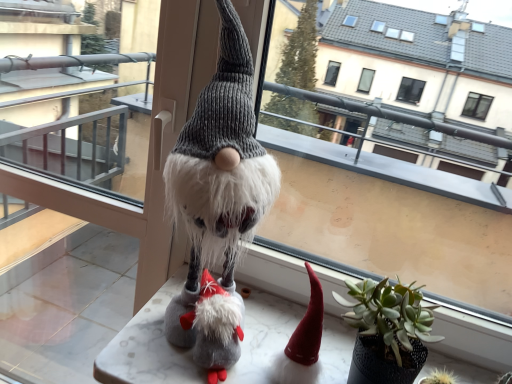
Question: Is transparent glass door at center far from green matte houseplant at center?

Choices:
 (A) yes
 (B) no

Answer: (A)

Question: Is transparent glass door at center behind green matte houseplant at center?

Choices:
 (A) no
 (B) yes

Answer: (B)

Question: Is transparent glass door at center surrounding green matte houseplant at center?

Choices:
 (A) yes
 (B) no

Answer: (B)

Question: Considering the relative sizes of transparent glass door at center and green matte houseplant at center in the image provided, is transparent glass door at center taller than green matte houseplant at center?

Choices:
 (A) yes
 (B) no

Answer: (A)

Question: Does transparent glass door at center touch green matte houseplant at center?

Choices:
 (A) yes
 (B) no

Answer: (B)

Question: From the image's perspective, is transparent glass door at center located beneath green matte houseplant at center?

Choices:
 (A) yes
 (B) no

Answer: (B)

Question: Does fuzzy gray knit gnome at center have a larger size compared to marble table at center?

Choices:
 (A) yes
 (B) no

Answer: (A)

Question: Is fuzzy gray knit gnome at center directly adjacent to marble table at center?

Choices:
 (A) no
 (B) yes

Answer: (A)

Question: From the image's perspective, is fuzzy gray knit gnome at center above marble table at center?

Choices:
 (A) no
 (B) yes

Answer: (B)

Question: Is fuzzy gray knit gnome at center in front of marble table at center?

Choices:
 (A) yes
 (B) no

Answer: (A)

Question: Is marble table at center located within fuzzy gray knit gnome at center?

Choices:
 (A) no
 (B) yes

Answer: (A)

Question: Is there a large distance between fuzzy gray knit gnome at center and marble table at center?

Choices:
 (A) no
 (B) yes

Answer: (A)

Question: Is marble table at center completely or partially outside of transparent glass door at center?

Choices:
 (A) yes
 (B) no

Answer: (A)